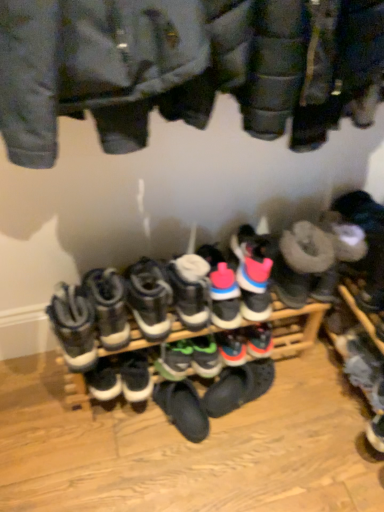
Locate an element on the screen. The width and height of the screenshot is (384, 512). free point in front of rubberized black shoes at center is located at coordinates [190, 461].